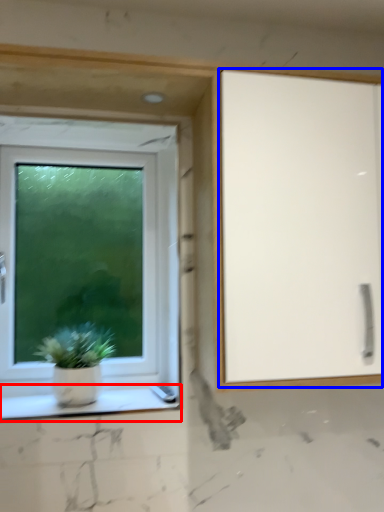
Question: Which of the following is the closest to the observer, window sill (highlighted by a red box) or screen door (highlighted by a blue box)?

Choices:
 (A) window sill
 (B) screen door

Answer: (B)